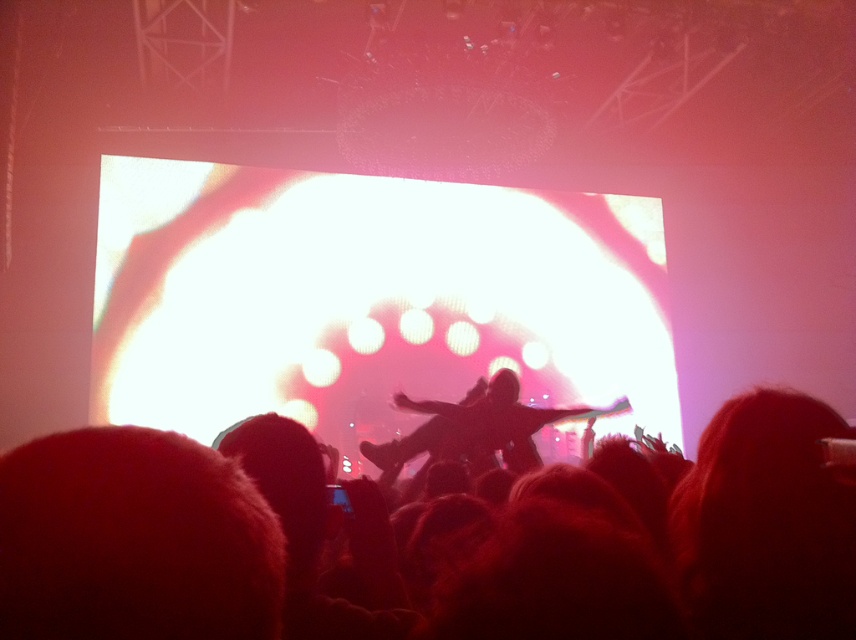
Who is higher up, silhouette hair at center or silhouette figure at center?

silhouette hair at center

Does silhouette hair at center appear on the right side of silhouette figure at center?

No, silhouette hair at center is not to the right of silhouette figure at center.

What do you see at coordinates (767, 522) in the screenshot? This screenshot has width=856, height=640. I see `silhouette hair at center` at bounding box center [767, 522].

Locate an element on the screen. This screenshot has height=640, width=856. silhouette hair at center is located at coordinates (767, 522).